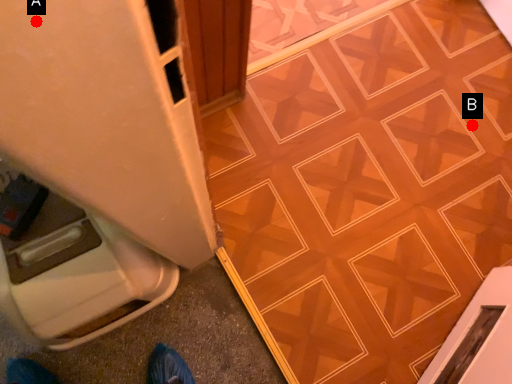
Question: Two points are circled on the image, labeled by A and B beside each circle. Which point is closer to the camera taking this photo?

Choices:
 (A) A is closer
 (B) B is closer

Answer: (A)